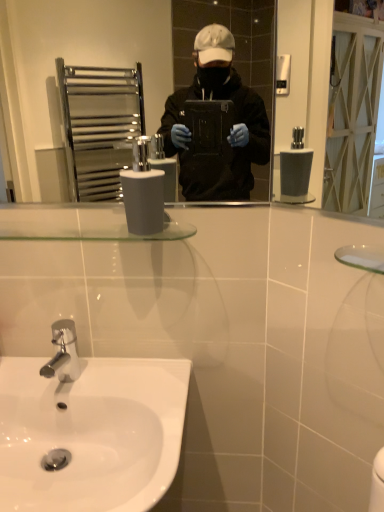
What do you see at coordinates (91, 433) in the screenshot?
I see `white glossy sink at lower left` at bounding box center [91, 433].

At what (x,y) coordinates should I click in order to perform the action: click on white glossy sink at lower left. Please return your answer as a coordinate pair (x, y). Looking at the image, I should click on (91, 433).

Measure the distance between point (158, 367) and camera.

Point (158, 367) is 38.62 inches away from camera.

In order to face white matte toilet paper at center, should I rotate leftwards or rightwards?

To align with it, rotate left about 6.724°.

What do you see at coordinates (143, 200) in the screenshot?
I see `white matte toilet paper at center` at bounding box center [143, 200].

What are the coordinates of `white matte toilet paper at center` in the screenshot? It's located at (143, 200).

Identify the location of white glossy sink at lower left. This screenshot has height=512, width=384. (91, 433).

Between white matte toilet paper at center and white glossy sink at lower left, which one appears on the left side from the viewer's perspective?

white glossy sink at lower left is more to the left.

Is the position of white matte toilet paper at center less distant than that of white glossy sink at lower left?

No, it is behind white glossy sink at lower left.

Between point (131, 193) and point (79, 424), which one is positioned behind?

The point (79, 424) is more distant.

From the image's perspective, would you say white matte toilet paper at center is positioned over white glossy sink at lower left?

Yes, from the image's perspective, white matte toilet paper at center is over white glossy sink at lower left.

From a real-world perspective, is white matte toilet paper at center located higher than white glossy sink at lower left?

Correct, in the physical world, white matte toilet paper at center is higher than white glossy sink at lower left.

Consider the image. Is white matte toilet paper at center thinner than white glossy sink at lower left?

Yes.

Considering the sizes of white matte toilet paper at center and white glossy sink at lower left in the image, is white matte toilet paper at center taller or shorter than white glossy sink at lower left?

Considering their sizes, white matte toilet paper at center has less height than white glossy sink at lower left.

Between white matte toilet paper at center and white glossy sink at lower left, which one has larger size?

With larger size is white glossy sink at lower left.

Is white matte toilet paper at center outside of white glossy sink at lower left?

Yes, white matte toilet paper at center is outside of white glossy sink at lower left.

Are white matte toilet paper at center and white glossy sink at lower left located far from each other?

No, there isn't a large distance between white matte toilet paper at center and white glossy sink at lower left.

Is white matte toilet paper at center facing towards white glossy sink at lower left?

No.

In order to click on sink that appears on the left of white matte toilet paper at center in this screenshot , I will do `click(91, 433)`.

Which object is positioned more to the left, white glossy sink at lower left or white matte toilet paper at center?

white glossy sink at lower left.

Is white glossy sink at lower left in front of or behind white matte toilet paper at center in the image?

white glossy sink at lower left is positioned closer to the viewer than white matte toilet paper at center.

Does point (90, 509) come closer to viewer compared to point (131, 195)?

Yes, it is.

From the image's perspective, who appears lower, white glossy sink at lower left or white matte toilet paper at center?

white glossy sink at lower left, from the image's perspective.

From a real-world perspective, is white glossy sink at lower left physically located above or below white matte toilet paper at center?

white glossy sink at lower left is below white matte toilet paper at center.

Which object is wider, white glossy sink at lower left or white matte toilet paper at center?

Wider between the two is white glossy sink at lower left.

Is white glossy sink at lower left shorter than white matte toilet paper at center?

No, white glossy sink at lower left is not shorter than white matte toilet paper at center.

In terms of size, does white glossy sink at lower left appear bigger or smaller than white matte toilet paper at center?

Considering their sizes, white glossy sink at lower left takes up more space than white matte toilet paper at center.

Would you say white glossy sink at lower left is inside or outside white matte toilet paper at center?

white glossy sink at lower left is not inside white matte toilet paper at center, it's outside.

Is white glossy sink at lower left far away from white matte toilet paper at center?

white glossy sink at lower left is near white matte toilet paper at center, not far away.

Is white matte toilet paper at center at the back of white glossy sink at lower left?

white glossy sink at lower left does not have its back to white matte toilet paper at center.

Can you tell me how much white glossy sink at lower left and white matte toilet paper at center differ in facing direction?

white glossy sink at lower left and white matte toilet paper at center are facing 2.76 degrees away from each other.

Measure the distance from white glossy sink at lower left to white matte toilet paper at center.

They are 17.02 inches apart.

Locate an element on the screen. toilet paper above the white glossy sink at lower left (from the image's perspective) is located at coordinates (143, 200).

This screenshot has width=384, height=512. Find the location of `toilet paper on the right of white glossy sink at lower left`. toilet paper on the right of white glossy sink at lower left is located at coordinates (143, 200).

Where is `sink in front of the white matte toilet paper at center`? sink in front of the white matte toilet paper at center is located at coordinates [91, 433].